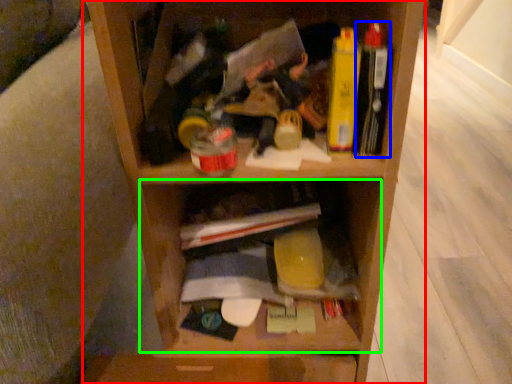
Question: Which object is positioned farthest from shelf (highlighted by a red box)? Select from book (highlighted by a blue box) and cabinet (highlighted by a green box).

Choices:
 (A) book
 (B) cabinet

Answer: (A)